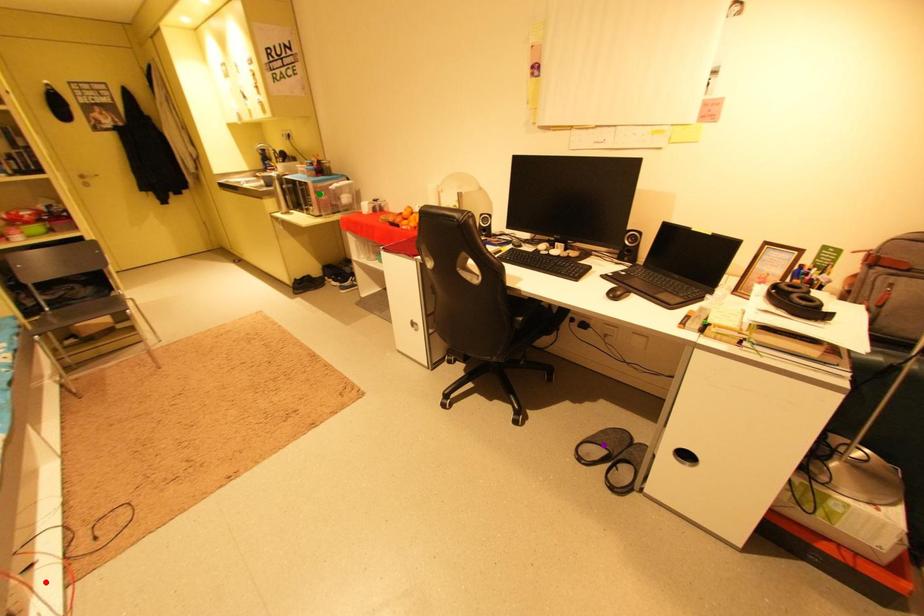
Order these from nearest to farthest:
A) green point
B) purple point
C) red point

red point
purple point
green point